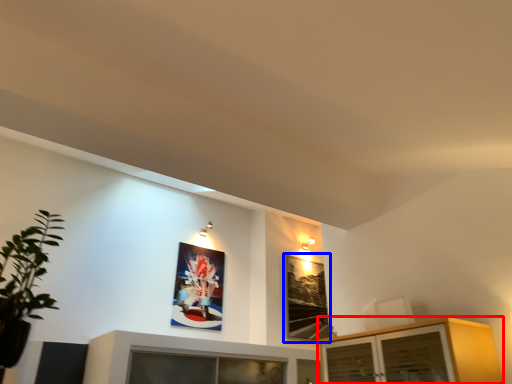
Question: Which object is closer to the camera taking this photo, cabinetry (highlighted by a red box) or picture frame (highlighted by a blue box)?

Choices:
 (A) cabinetry
 (B) picture frame

Answer: (A)